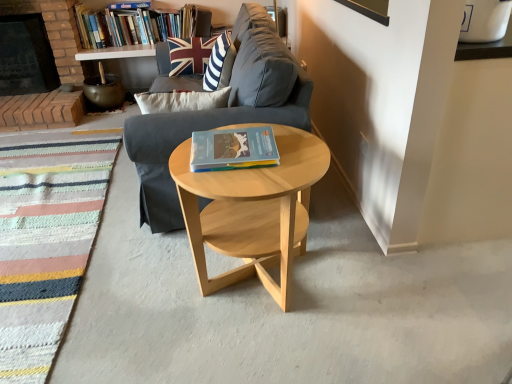
Identify the location of free point to the right of hardcover book at center, the second book from the left. This screenshot has width=512, height=384. (296, 151).